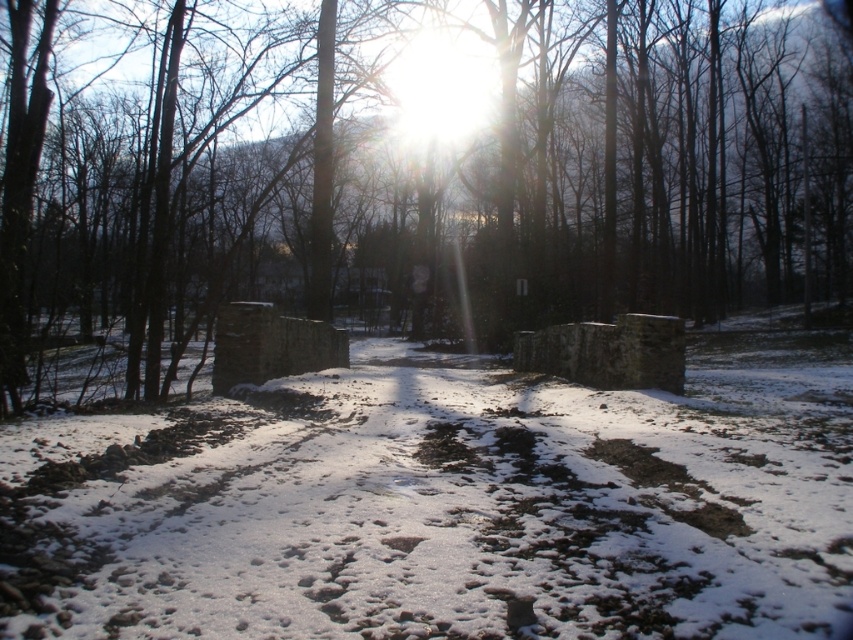
Question: Which object appears farthest from the camera in this image?

Choices:
 (A) white powdery snow at center
 (B) brown wood tree at center

Answer: (B)

Question: Can you confirm if brown wood tree at center is thinner than white powdery snow at center?

Choices:
 (A) yes
 (B) no

Answer: (B)

Question: Is brown wood tree at center thinner than white powdery snow at center?

Choices:
 (A) no
 (B) yes

Answer: (A)

Question: Does brown wood tree at center appear on the right side of white powdery snow at center?

Choices:
 (A) yes
 (B) no

Answer: (A)

Question: Which of the following is the closest to the observer?

Choices:
 (A) (200, 49)
 (B) (786, 376)

Answer: (B)

Question: Which of the following is the closest to the observer?

Choices:
 (A) white powdery snow at center
 (B) brown wood tree at center

Answer: (A)